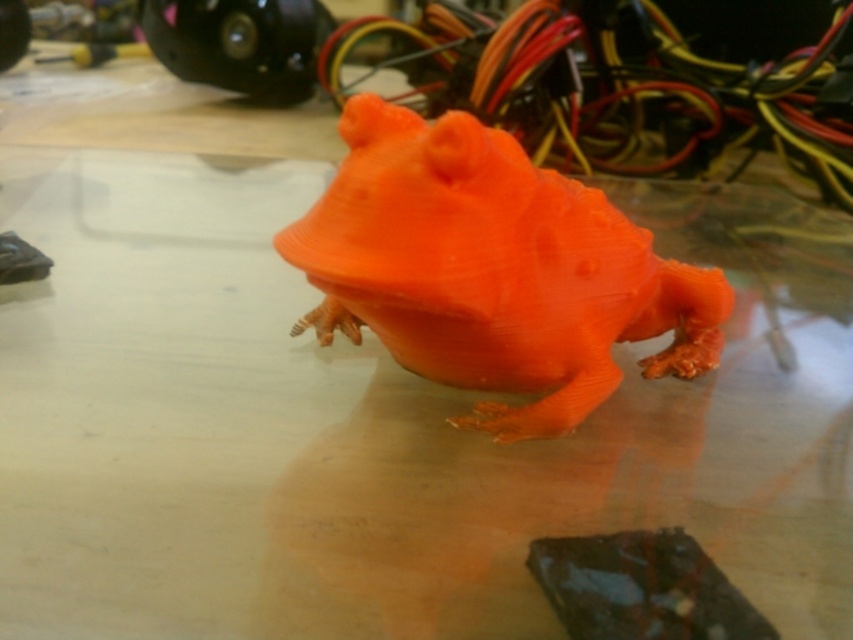
Question: Which of these objects is positioned closest to the dark chocolate bar at lower right?

Choices:
 (A) orange matte plastic frog at center
 (B) orange matte wire at upper center

Answer: (A)

Question: Is orange matte plastic frog at center bigger than dark chocolate bar at lower right?

Choices:
 (A) no
 (B) yes

Answer: (B)

Question: Which object appears closest to the camera in this image?

Choices:
 (A) dark chocolate bar at lower right
 (B) orange matte wire at upper center
 (C) orange matte plastic frog at center

Answer: (A)

Question: Which of these objects is positioned farthest from the orange matte wire at upper center?

Choices:
 (A) orange matte plastic frog at center
 (B) dark chocolate bar at lower right

Answer: (B)

Question: Can you confirm if orange matte plastic frog at center is positioned below dark chocolate bar at lower right?

Choices:
 (A) no
 (B) yes

Answer: (A)

Question: Does orange matte plastic frog at center have a larger size compared to orange matte wire at upper center?

Choices:
 (A) yes
 (B) no

Answer: (B)